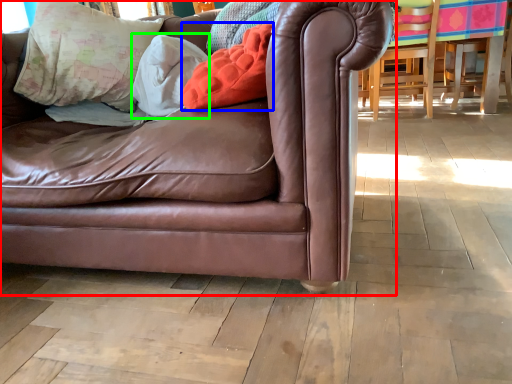
Question: Which object is the closest to the studio couch (highlighted by a red box)? Choose among these: pillow (highlighted by a blue box) or pillow (highlighted by a green box).

Choices:
 (A) pillow
 (B) pillow

Answer: (A)